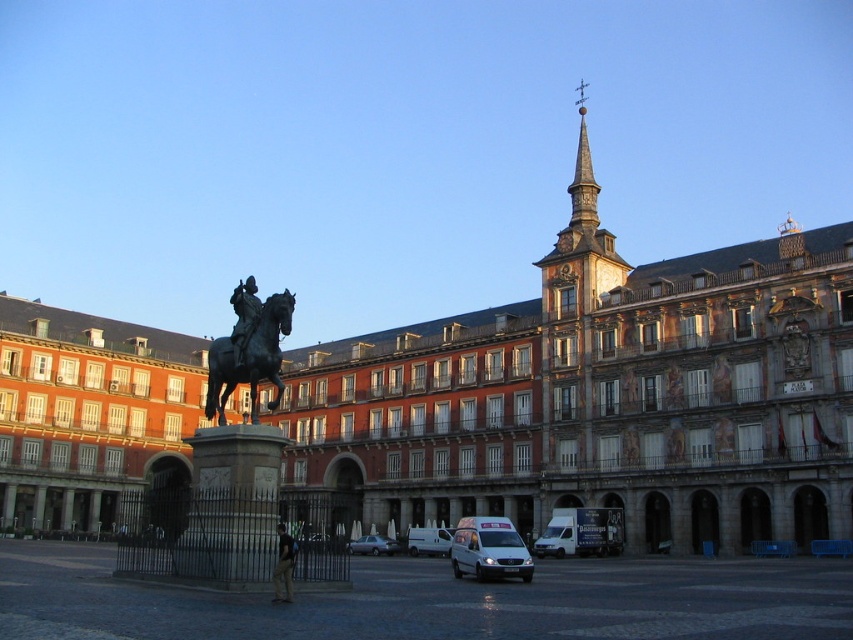
Question: Is dark gray fabric jacket at center bigger than metallic silver sedan at center?

Choices:
 (A) no
 (B) yes

Answer: (A)

Question: Is dark gray fabric jacket at center bigger than white matte van at center?

Choices:
 (A) yes
 (B) no

Answer: (B)

Question: Which object appears closest to the camera in this image?

Choices:
 (A) white van at center
 (B) dark gray fabric jacket at center
 (C) brown stone tower at upper center
 (D) white matte van at center

Answer: (B)

Question: Is dark gray fabric jacket at center positioned behind metallic silver sedan at center?

Choices:
 (A) yes
 (B) no

Answer: (B)

Question: Which of the following is the closest to the observer?

Choices:
 (A) shiny black horse at center
 (B) white matte van at center

Answer: (A)

Question: Among these objects, which one is farthest from the camera?

Choices:
 (A) shiny black horse at center
 (B) white matte van at center
 (C) white matte van at lower center

Answer: (B)